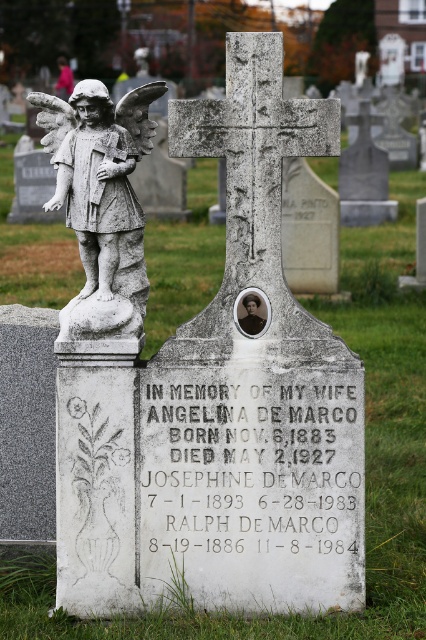
Question: In this image, where is white marble statue at upper left located relative to white stone angel at left?

Choices:
 (A) right
 (B) left

Answer: (A)

Question: Which point is closer to the camera?

Choices:
 (A) white marble statue at upper left
 (B) white stone angel at left

Answer: (A)

Question: Can you confirm if white marble statue at upper left is positioned to the left of white stone angel at left?

Choices:
 (A) yes
 (B) no

Answer: (B)

Question: Does white marble statue at upper left appear on the left side of white stone angel at left?

Choices:
 (A) no
 (B) yes

Answer: (A)